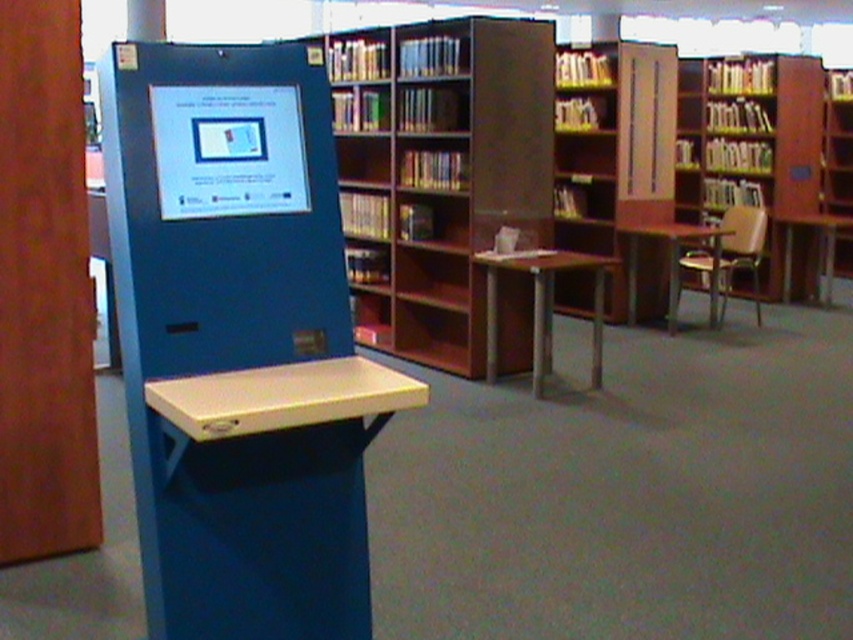
Question: Estimate the real-world distances between objects in this image. Which object is closer to the wooden bookcase at right?

Choices:
 (A) matte plastic screen at center
 (B) brown wood bookcase at center
 (C) brown wooden bookshelf at center

Answer: (C)

Question: Is wooden bookcase at right to the right of matte plastic screen at center from the viewer's perspective?

Choices:
 (A) yes
 (B) no

Answer: (A)

Question: Which point is closer to the camera?

Choices:
 (A) brown wooden bookshelf at center
 (B) matte plastic screen at center
 (C) wooden bookcase at right
 (D) brown wood bookcase at center

Answer: (B)

Question: Which point is farther to the camera?

Choices:
 (A) matte plastic screen at center
 (B) wooden bookcase at right
 (C) brown wooden bookshelf at center
 (D) brown wood bookcase at center

Answer: (B)

Question: Does brown wood bookcase at center appear on the right side of brown wooden bookshelf at center?

Choices:
 (A) no
 (B) yes

Answer: (A)

Question: Considering the relative positions of brown wooden bookshelf at center and matte plastic screen at center in the image provided, where is brown wooden bookshelf at center located with respect to matte plastic screen at center?

Choices:
 (A) right
 (B) left

Answer: (A)